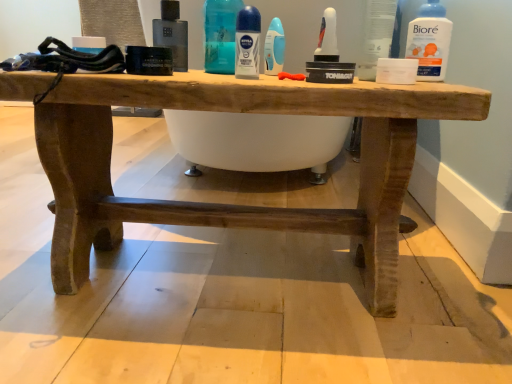
Find the location of a particular element. The width and height of the screenshot is (512, 384). free spot below rustic wood table at center (from a real-world perspective) is located at coordinates (229, 265).